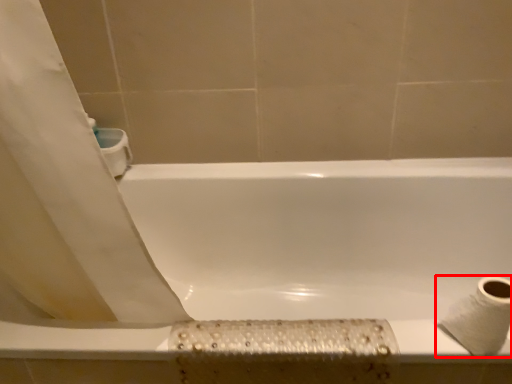
Question: From the image's perspective, what is the correct spatial relationship of toilet paper (annotated by the red box) in relation to bathtub?

Choices:
 (A) above
 (B) below

Answer: (A)